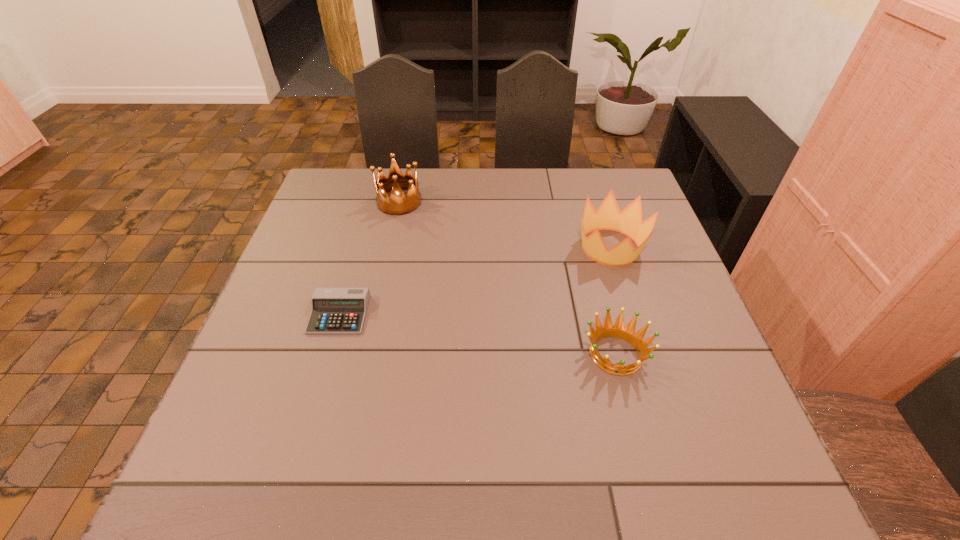
Where is `free space between the farthest crown and the second farthest crown`? free space between the farthest crown and the second farthest crown is located at coordinates (505, 225).

The image size is (960, 540). Identify the location of empty space that is in between the shortest object and the nearest crown. (477, 334).

Locate an element on the screen. vacant area between the leftmost crown and the nearest crown is located at coordinates (508, 278).

Locate an element on the screen. The height and width of the screenshot is (540, 960). free spot between the shortest object and the second shortest object is located at coordinates (477, 334).

Image resolution: width=960 pixels, height=540 pixels. Find the location of `blank region between the shortest object and the third nearest object`. blank region between the shortest object and the third nearest object is located at coordinates (475, 281).

Identify the location of object that is the third closest one to the calculator. The image size is (960, 540). (608, 216).

Find the location of a particular element. This screenshot has height=540, width=960. object that is the closest to the shortest object is located at coordinates (398, 204).

Choose which crown is the third nearest neighbor to the calculator. Please provide its 2D coordinates. Your answer should be formatted as a tuple, i.e. [(x, y)], where the tuple contains the x and y coordinates of a point satisfying the conditions above.

[(608, 216)]

I want to click on crown identified as the second closest to the second shortest object, so click(398, 204).

The width and height of the screenshot is (960, 540). Identify the location of free space that satisfies the following two spatial constraints: 1. on the front side of the farthest crown; 2. on the left side of the third nearest object. (389, 247).